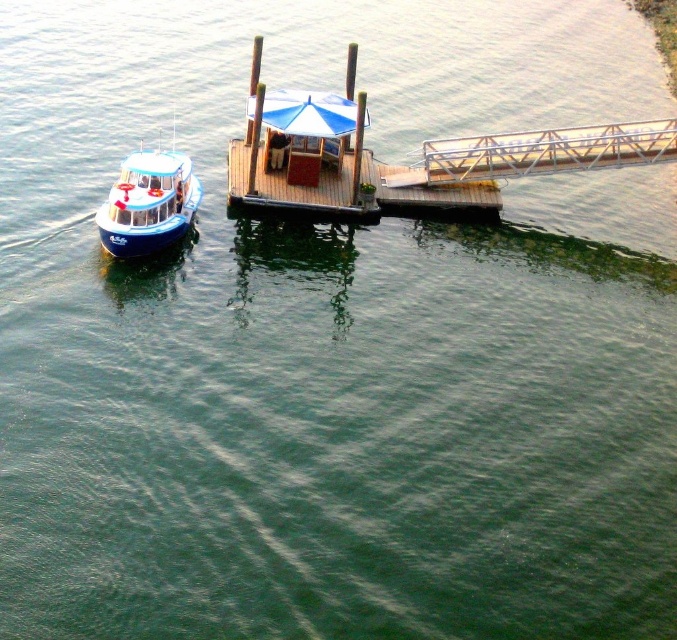
Question: Is the position of metallic gray dock at upper right more distant than that of blue glossy boat at left?

Choices:
 (A) yes
 (B) no

Answer: (A)

Question: Can you confirm if metallic gray dock at upper right is thinner than blue glossy boat at left?

Choices:
 (A) no
 (B) yes

Answer: (A)

Question: Where is metallic gray dock at upper right located in relation to blue glossy boat at left in the image?

Choices:
 (A) below
 (B) above

Answer: (B)

Question: Which of the following is the farthest from the observer?

Choices:
 (A) metallic gray dock at upper right
 (B) blue glossy boat at left

Answer: (A)

Question: Which point appears closest to the camera in this image?

Choices:
 (A) (431, 177)
 (B) (116, 252)

Answer: (B)